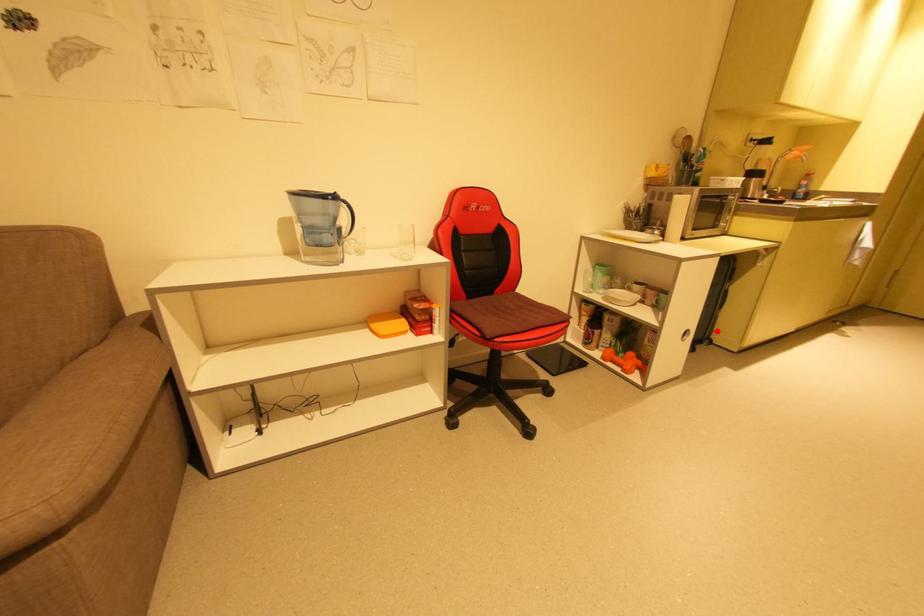
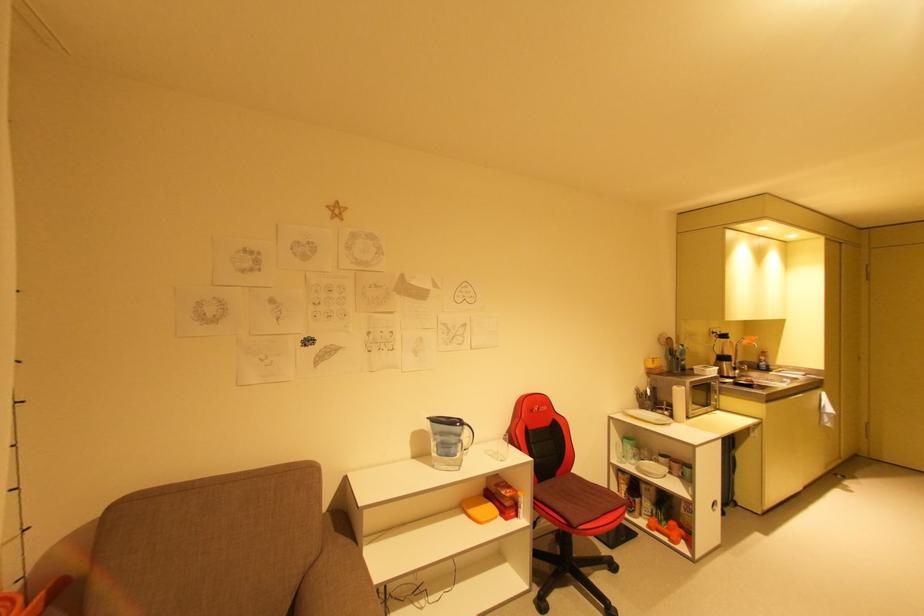
Question: I am providing you with two images of the same scene from different viewpoints. Given a red point in image1, look at the same physical point in image2. Is it:

Choices:
 (A) Closer to the viewpoint
 (B) Farther from the viewpoint

Answer: (A)